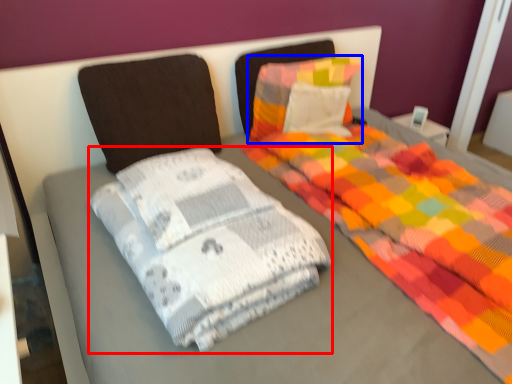
Question: Which object appears farthest to the camera in this image, material (highlighted by a red box) or pillow (highlighted by a blue box)?

Choices:
 (A) material
 (B) pillow

Answer: (B)